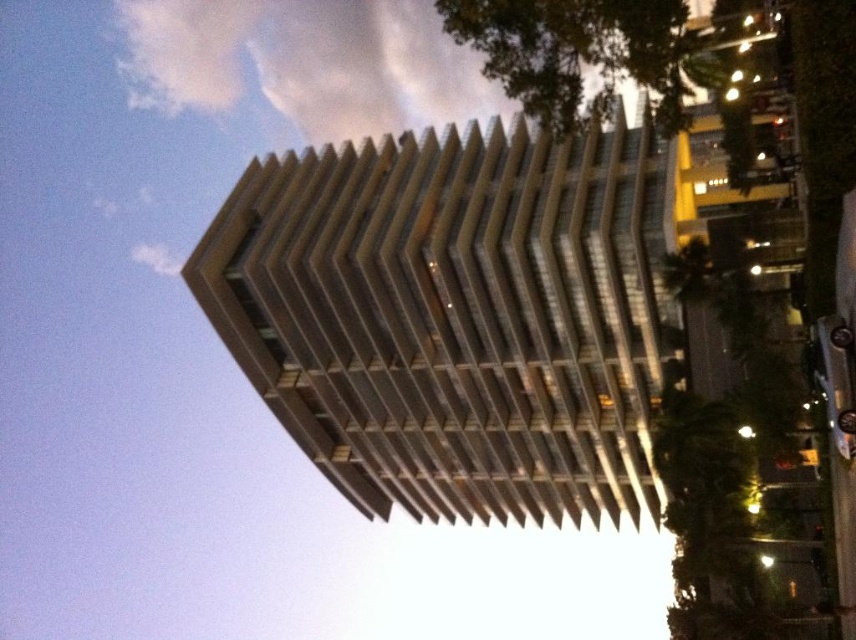
You are standing at the point marked by point (x=453, y=316) in the image. What is the color of the building directly beneath you?

The point (x=453, y=316) marks the sandy beige concrete building at center, so the building directly beneath you is sandy beige in color.

You are standing in front of the modern multi story building. You notice two points marked on the building facade. The first point is at coordinates point (x=428, y=464) and the second point is at point (x=245, y=48). Which of these two points is nearer to your current position?

Point (x=428, y=464) is closer to the camera than point (x=245, y=48), so the first point is nearer to your current position.

You are an architect analyzing the building design. Based on the image, which object is shorter between the sandy beige concrete building at center and the white fluffy cloud at upper center?

The sandy beige concrete building at center is shorter than the white fluffy cloud at upper center.